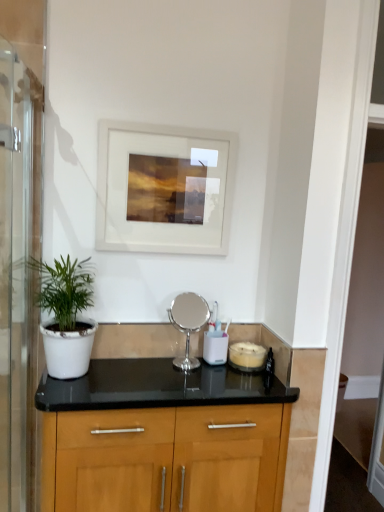
Question: From the image's perspective, is transparent glass screen door at left on top of white matte pot at left?

Choices:
 (A) yes
 (B) no

Answer: (B)

Question: Does transparent glass screen door at left lie in front of white matte pot at left?

Choices:
 (A) no
 (B) yes

Answer: (B)

Question: From a real-world perspective, does transparent glass screen door at left stand above white matte pot at left?

Choices:
 (A) yes
 (B) no

Answer: (B)

Question: Does transparent glass screen door at left have a greater width compared to white matte pot at left?

Choices:
 (A) no
 (B) yes

Answer: (A)

Question: Considering the relative sizes of transparent glass screen door at left and white matte pot at left in the image provided, is transparent glass screen door at left shorter than white matte pot at left?

Choices:
 (A) no
 (B) yes

Answer: (A)

Question: Is transparent glass screen door at left taller than white matte pot at left?

Choices:
 (A) yes
 (B) no

Answer: (A)

Question: Can white glossy candle at center, which is counted as the 2th appliance, starting from the left, be found inside transparent glass screen door at left?

Choices:
 (A) no
 (B) yes

Answer: (A)

Question: From a real-world perspective, is transparent glass screen door at left physically below white glossy candle at center, which is counted as the 2th appliance, starting from the left?

Choices:
 (A) yes
 (B) no

Answer: (B)

Question: Is transparent glass screen door at left facing towards white glossy candle at center, placed as the first appliance when sorted from right to left?

Choices:
 (A) yes
 (B) no

Answer: (A)

Question: Is transparent glass screen door at left closer to camera compared to white glossy candle at center, which is counted as the 2th appliance, starting from the left?

Choices:
 (A) no
 (B) yes

Answer: (B)

Question: From the image's perspective, would you say transparent glass screen door at left is shown under white glossy candle at center, which is counted as the 2th appliance, starting from the left?

Choices:
 (A) yes
 (B) no

Answer: (B)

Question: From the image's perspective, does transparent glass screen door at left appear higher than white glossy candle at center, placed as the first appliance when sorted from right to left?

Choices:
 (A) no
 (B) yes

Answer: (B)

Question: Considering the relative sizes of transparent glass screen door at left and white matte picture frame at upper center in the image provided, is transparent glass screen door at left taller than white matte picture frame at upper center?

Choices:
 (A) no
 (B) yes

Answer: (B)